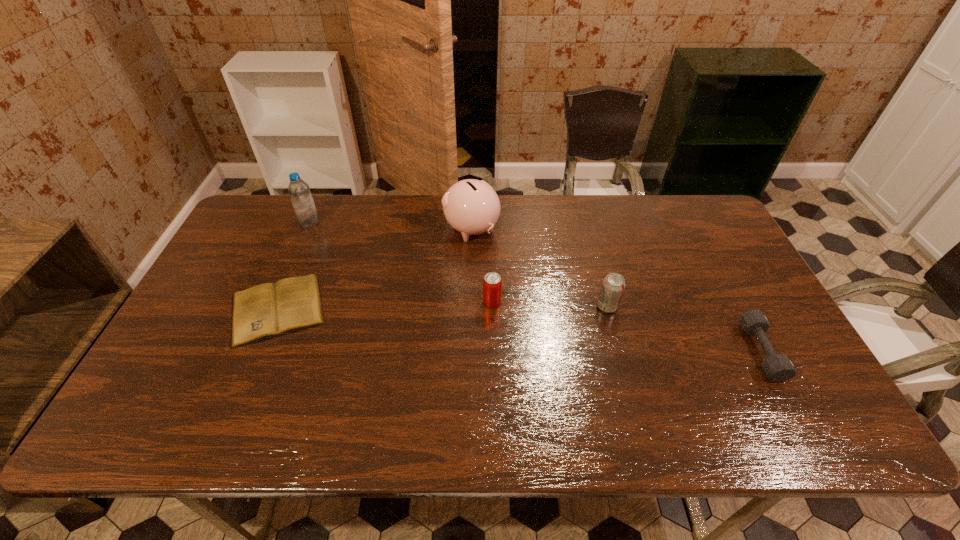
Image resolution: width=960 pixels, height=540 pixels. In the image, there is a desktop. What are the coordinates of `vacant space at the near right corner` in the screenshot? It's located at (837, 426).

Locate an element on the screen. The image size is (960, 540). vacant point located between the water bottle and the fifth object from left to right is located at coordinates (459, 264).

You are a GUI agent. You are given a task and a screenshot of the screen. Output one action in this format:
    pyautogui.click(x=<x>, y=<y>)
    Task: Click on the vacant space that's between the dumbbell and the can
    The width and height of the screenshot is (960, 540).
    Given the screenshot: What is the action you would take?
    pyautogui.click(x=626, y=327)

Where is `vacant area between the water bottle and the piggy bank`? The width and height of the screenshot is (960, 540). vacant area between the water bottle and the piggy bank is located at coordinates (391, 226).

This screenshot has height=540, width=960. Find the location of `free area in between the fifth object from left to right and the second shortest object`. free area in between the fifth object from left to right and the second shortest object is located at coordinates (684, 329).

Where is `vacant area that lies between the book and the soda can`? vacant area that lies between the book and the soda can is located at coordinates (443, 308).

Locate an element on the screen. The width and height of the screenshot is (960, 540). vacant point located between the book and the rightmost object is located at coordinates (519, 330).

Where is `empty space that is in between the water bottle and the can`? Image resolution: width=960 pixels, height=540 pixels. empty space that is in between the water bottle and the can is located at coordinates (401, 262).

In order to click on free space between the rightmost object and the water bottle in this screenshot , I will do `click(536, 287)`.

Identify the location of empty space between the second object from right to left and the can. The width and height of the screenshot is (960, 540). (549, 304).